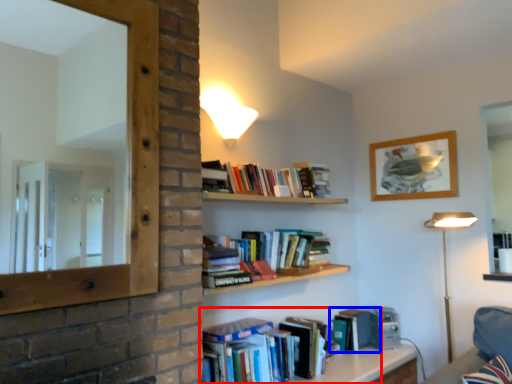
Question: Which object is closer to the camera taking this photo, book (highlighted by a red box) or paperback book (highlighted by a blue box)?

Choices:
 (A) book
 (B) paperback book

Answer: (A)